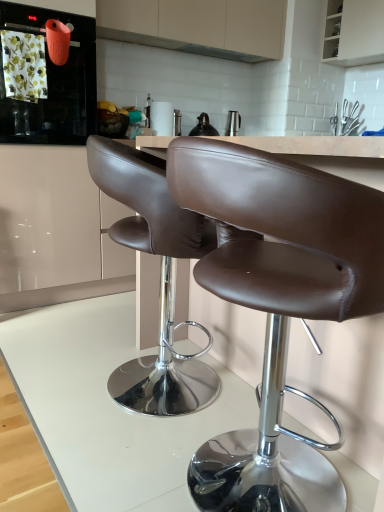
What do you see at coordinates (160, 278) in the screenshot? The height and width of the screenshot is (512, 384). I see `brown leather chair at center, the 1th chair positioned from the back` at bounding box center [160, 278].

The image size is (384, 512). Find the location of `white glossy table at center`. white glossy table at center is located at coordinates (108, 408).

What do you see at coordinates (198, 26) in the screenshot? This screenshot has height=512, width=384. I see `matte beige cabinet at upper center, which ranks as the first cabinetry in left-to-right order` at bounding box center [198, 26].

Describe the element at coordinates (203, 127) in the screenshot. This screenshot has width=384, height=512. I see `black matte tea pot at upper center` at that location.

Where is `brown leather chair at center, the 1th chair positioned from the back`? brown leather chair at center, the 1th chair positioned from the back is located at coordinates (160, 278).

Identify the location of exhaust hood in front of the black matte tea pot at upper center. This screenshot has width=384, height=512. (219, 53).

Between black matte tea pot at upper center and metallic silver exhaust hood at upper center, which one has smaller width?

metallic silver exhaust hood at upper center is thinner.

Which of these two, black matte tea pot at upper center or metallic silver exhaust hood at upper center, is smaller?

Smaller between the two is metallic silver exhaust hood at upper center.

In terms of height, does black matte tea pot at upper center look taller or shorter compared to metallic silver exhaust hood at upper center?

Clearly, black matte tea pot at upper center is taller compared to metallic silver exhaust hood at upper center.

Would you say black matte tea pot at upper center is inside or outside brown leather chair at center, the 1th chair positioned from the back?

black matte tea pot at upper center lies outside brown leather chair at center, the 1th chair positioned from the back.

Is black matte tea pot at upper center bigger than brown leather chair at center, the 2th chair positioned from the front?

Incorrect, black matte tea pot at upper center is not larger than brown leather chair at center, the 2th chair positioned from the front.

From the image's perspective, is black matte tea pot at upper center located above or below brown leather chair at center, the 1th chair positioned from the back?

From the image's perspective, black matte tea pot at upper center appears above brown leather chair at center, the 1th chair positioned from the back.

The height and width of the screenshot is (512, 384). In order to click on tea pot behind the brown leather chair at center, the 1th chair positioned from the back in this screenshot , I will do 203,127.

Is white glossy table at center bigger or smaller than white glossy cabinet at upper right, placed as the first cabinetry when sorted from right to left?

Result: Considering their sizes, white glossy table at center takes up more space than white glossy cabinet at upper right, placed as the first cabinetry when sorted from right to left.

Which is behind, point (25, 316) or point (325, 61)?

Point (325, 61)

Consider the image. Considering the sizes of white glossy table at center and white glossy cabinet at upper right, placed as the first cabinetry when sorted from right to left, in the image, is white glossy table at center taller or shorter than white glossy cabinet at upper right, placed as the first cabinetry when sorted from right to left,?

Considering their sizes, white glossy table at center has less height than white glossy cabinet at upper right, placed as the first cabinetry when sorted from right to left.

Is white glossy table at center far away from white glossy cabinet at upper right, marked as the 2th cabinetry in a left-to-right arrangement?

Yes, white glossy table at center is far from white glossy cabinet at upper right, marked as the 2th cabinetry in a left-to-right arrangement.

Is white glossy cabinet at upper right, marked as the 2th cabinetry in a left-to-right arrangement, oriented towards brown leather chair at center, the 1th chair positioned from the back?

No, white glossy cabinet at upper right, marked as the 2th cabinetry in a left-to-right arrangement, is not oriented towards brown leather chair at center, the 1th chair positioned from the back.

From the image's perspective, relative to brown leather chair at center, the 2th chair positioned from the front, is white glossy cabinet at upper right, placed as the first cabinetry when sorted from right to left, above or below?

white glossy cabinet at upper right, placed as the first cabinetry when sorted from right to left, is above brown leather chair at center, the 2th chair positioned from the front.

What's the angular difference between white glossy cabinet at upper right, marked as the 2th cabinetry in a left-to-right arrangement, and brown leather chair at center, the 2th chair positioned from the front,'s facing directions?

There is a 180-degree angle between the facing directions of white glossy cabinet at upper right, marked as the 2th cabinetry in a left-to-right arrangement, and brown leather chair at center, the 2th chair positioned from the front.

Is white glossy cabinet at upper right, marked as the 2th cabinetry in a left-to-right arrangement, smaller than brown leather chair at center, the 1th chair positioned from the back?

Indeed, white glossy cabinet at upper right, marked as the 2th cabinetry in a left-to-right arrangement, has a smaller size compared to brown leather chair at center, the 1th chair positioned from the back.

Does brown leather chair at center, the 1th chair positioned from the back, appear on the right side of metallic silver exhaust hood at upper center?

No.

Is brown leather chair at center, the 2th chair positioned from the front, far from metallic silver exhaust hood at upper center?

Yes, brown leather chair at center, the 2th chair positioned from the front, and metallic silver exhaust hood at upper center are located far from each other.

Does brown leather chair at center, the 2th chair positioned from the front, have a smaller size compared to metallic silver exhaust hood at upper center?

No.

From the image's perspective, is matte orange kettle at upper left above white glossy table at center?

Correct, matte orange kettle at upper left appears higher than white glossy table at center in the image.

Between matte orange kettle at upper left and white glossy table at center, which one has smaller size?

With smaller size is matte orange kettle at upper left.

Is matte orange kettle at upper left not within white glossy table at center?

matte orange kettle at upper left is positioned outside white glossy table at center.

In the image, is matte orange kettle at upper left on the left side or the right side of white glossy table at center?

From the image, it's evident that matte orange kettle at upper left is to the left of white glossy table at center.

From a real-world perspective, is brown leather chair at center, the 1th chair positioned from the back, positioned above or below black matte tea pot at upper center?

brown leather chair at center, the 1th chair positioned from the back, is situated lower than black matte tea pot at upper center in the real world.

Is brown leather chair at center, the 1th chair positioned from the back, wider or thinner than black matte tea pot at upper center?

brown leather chair at center, the 1th chair positioned from the back, is wider than black matte tea pot at upper center.

From the image's perspective, between brown leather chair at center, the 1th chair positioned from the back, and black matte tea pot at upper center, who is located below?

brown leather chair at center, the 1th chair positioned from the back, appears lower in the image.

Which is farther from the camera, (216, 377) or (202, 130)?

Positioned behind is point (202, 130).

This screenshot has height=512, width=384. Identify the location of tea pot behind the metallic silver exhaust hood at upper center. (203, 127).

Locate an element on the screen. This screenshot has width=384, height=512. tea pot above the brown leather chair at center, the 1th chair positioned from the back (from a real-world perspective) is located at coordinates (203, 127).

When comparing their distances from brown leather chair at center, the 1th chair from the front, does black matte tea pot at upper center or matte orange kettle at upper left seem closer?

matte orange kettle at upper left lies closer to brown leather chair at center, the 1th chair from the front, than the other object.

Which object lies nearer to the anchor point black matte tea pot at upper center, brown leather chair at center, the 1th chair positioned from the back, or white glossy table at center?

Among the two, brown leather chair at center, the 1th chair positioned from the back, is located nearer to black matte tea pot at upper center.

Based on their spatial positions, is brown leather chair at center, the 2th chair positioned from the front, or brown leather chair at center, the 1th chair from the front, closer to white glossy table at center?

brown leather chair at center, the 2th chair positioned from the front, lies closer to white glossy table at center than the other object.

Considering their positions, is black matte tea pot at upper center positioned closer to brown leather chair at center, the 1th chair from the front, than metallic silver exhaust hood at upper center?

black matte tea pot at upper center lies closer to brown leather chair at center, the 1th chair from the front, than the other object.

From the image, which object appears to be farther from metallic silver exhaust hood at upper center, black matte tea pot at upper center or brown leather chair at center, the 1th chair positioned from the back?

brown leather chair at center, the 1th chair positioned from the back, is further to metallic silver exhaust hood at upper center.

Looking at the image, which one is located further to metallic silver exhaust hood at upper center, brown leather chair at center, the 2th chair positioned from the front, or white glossy table at center?

white glossy table at center is further to metallic silver exhaust hood at upper center.

When comparing their distances from white glossy table at center, does metallic silver exhaust hood at upper center or brown leather chair at center, which is counted as the 2th chair, starting from the back, seem further?

metallic silver exhaust hood at upper center is further to white glossy table at center.

Looking at this image, based on their spatial positions, is white glossy cabinet at upper right, placed as the first cabinetry when sorted from right to left, or black matte tea pot at upper center further from white glossy table at center?

white glossy cabinet at upper right, placed as the first cabinetry when sorted from right to left, lies further to white glossy table at center than the other object.

You are a GUI agent. You are given a task and a screenshot of the screen. Output one action in this format:
    pyautogui.click(x=<x>, y=<y>)
    Task: Click on the cabinetry between brown leather chair at center, the 1th chair positioned from the back, and black matte tea pot at upper center, along the z-axis
    This screenshot has height=512, width=384.
    Given the screenshot: What is the action you would take?
    pyautogui.click(x=198, y=26)

I want to click on exhaust hood between matte beige cabinet at upper center, which ranks as the first cabinetry in left-to-right order, and white glossy cabinet at upper right, marked as the 2th cabinetry in a left-to-right arrangement, from left to right, so click(x=219, y=53).

The image size is (384, 512). I want to click on exhaust hood between matte beige cabinet at upper center, the second cabinetry positioned from the right, and brown leather chair at center, the 2th chair positioned from the front, in the up-down direction, so click(x=219, y=53).

Where is `exhaust hood positioned between brown leather chair at center, the 1th chair from the front, and black matte tea pot at upper center from near to far`? This screenshot has width=384, height=512. exhaust hood positioned between brown leather chair at center, the 1th chair from the front, and black matte tea pot at upper center from near to far is located at coordinates (219, 53).